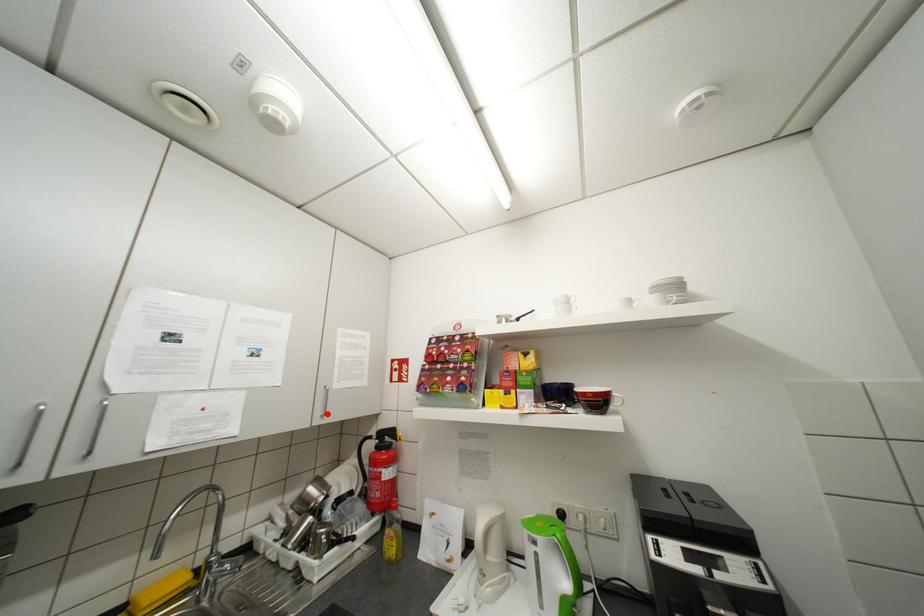
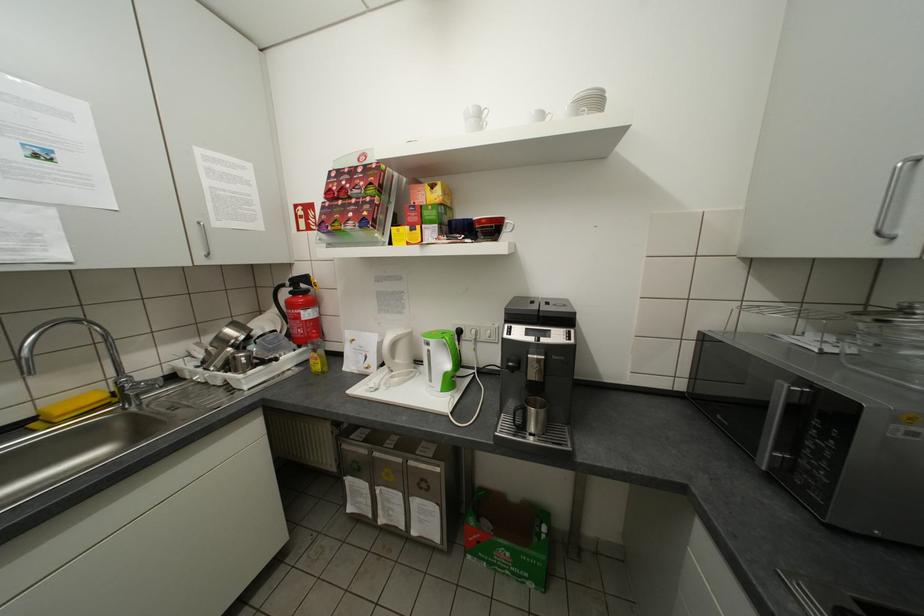
The point at the highlighted location is marked in the first image. Where is the corresponding point in the second image?

(209, 253)